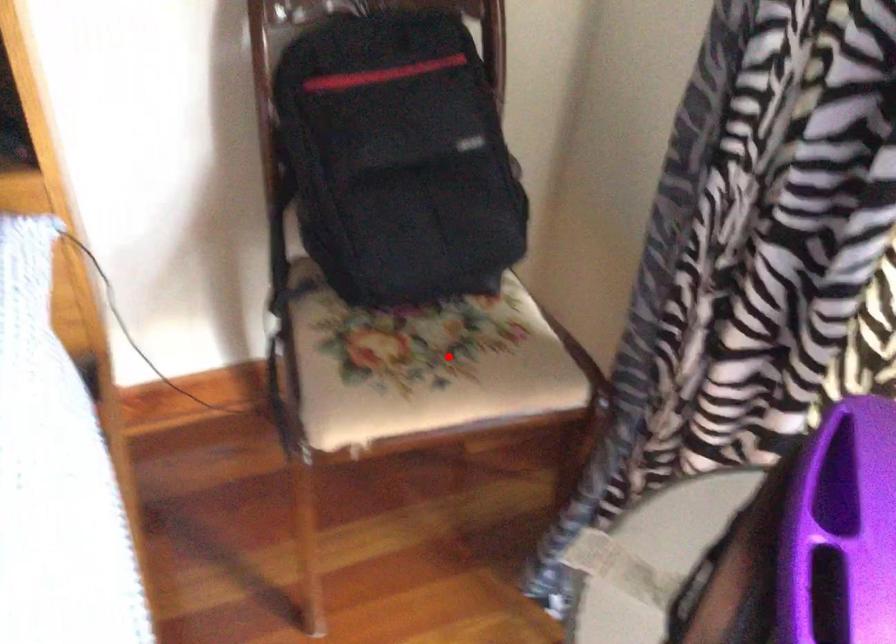
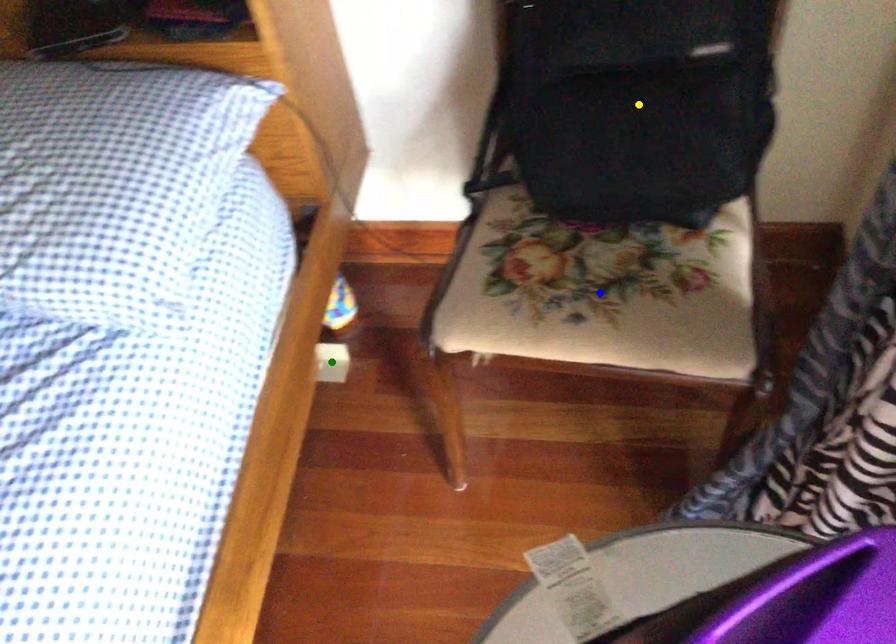
Question: I am providing you with two images of the same scene from different viewpoints. A red point is marked on the first image. You are given multiple points on the second image. Which mark in image 2 goes with the point in image 1?

Choices:
 (A) blue point
 (B) yellow point
 (C) green point

Answer: (A)